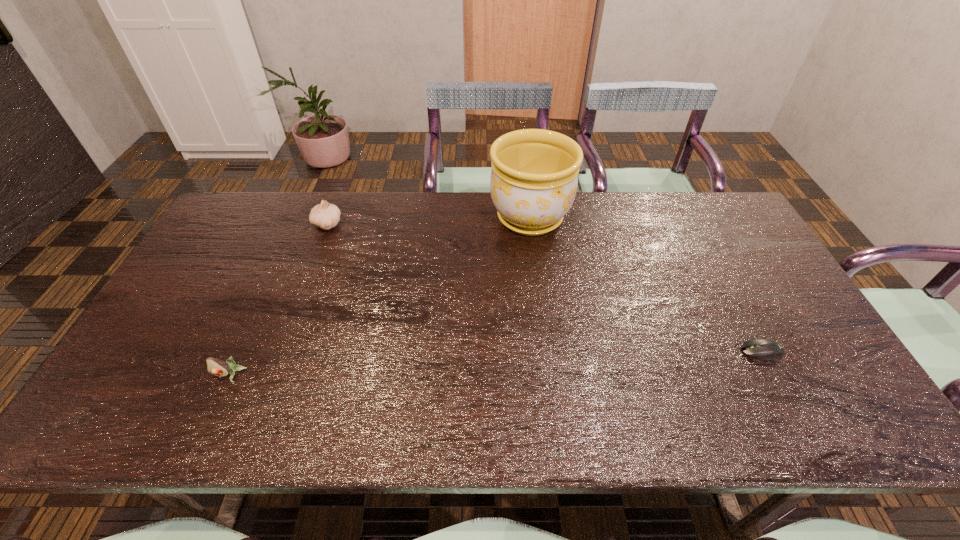
I want to click on vacant region located 0.340m on the wheel side of the rightmost object, so click(606, 351).

Find the location of a particular element. This screenshot has width=960, height=540. vacant region located on the wheel side of the rightmost object is located at coordinates (717, 351).

The height and width of the screenshot is (540, 960). Identify the location of free space located 0.230m on the wheel side of the rightmost object. (649, 351).

Locate an element on the screen. flowerpot that is at the far edge is located at coordinates (534, 177).

Find the location of `garlic present at the far edge`. garlic present at the far edge is located at coordinates click(x=325, y=215).

This screenshot has height=540, width=960. I want to click on object that is positioned at the right edge, so click(x=764, y=349).

This screenshot has width=960, height=540. Find the location of `vacant space at the far edge`. vacant space at the far edge is located at coordinates (393, 228).

Locate an element on the screen. The image size is (960, 540). free space at the near edge of the desktop is located at coordinates (674, 420).

In order to click on vacant position at the left edge of the desktop in this screenshot , I will do `click(252, 248)`.

Identify the location of vacant space at the far left corner of the desktop. This screenshot has width=960, height=540. (257, 211).